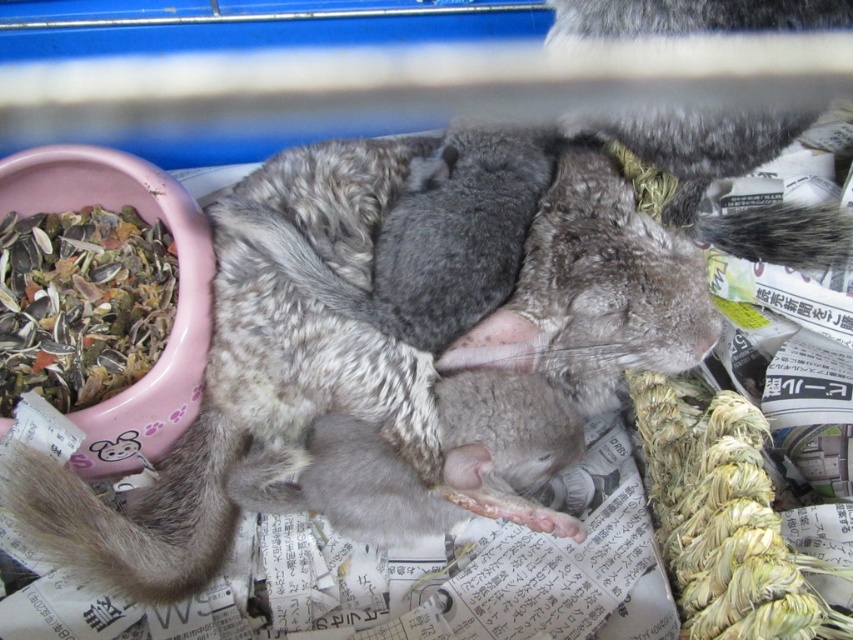
You are a chinchilla owner who wants to place a new toy in the enclosure. The toy requires a space that is not occupied by the multicolored grain mix at left. Based on the image, where should you place the toy?

The multicolored grain mix at left is located at point (80, 304), so you should place the toy in an area away from that coordinate to avoid occupying its space.

You are standing in front of the enclosure and want to determine which of the two points, point (91, 504) or point (834, 225), is nearer to you. Based on the spatial arrangement, which point is closer?

Point (91, 504) is closer to the viewer than point (834, 225).

You are a pet owner who wants to ensure the multicolored grain mix at left and the gray fluffy tail at upper right are visible in your photo. Since the enclosure is small, you need to adjust the camera angle. Which object should you focus on first to ensure both are in frame?

The multicolored grain mix at left has a larger size compared to the gray fluffy tail at upper right, so you should focus on the multicolored grain mix at left first to ensure both objects are in frame.